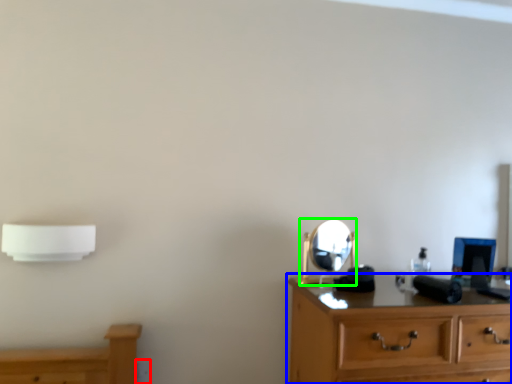
Question: Based on their relative distances, which object is nearer to electric outlet (highlighted by a red box)? Choose from chest of drawers (highlighted by a blue box) and mirror (highlighted by a green box).

Choices:
 (A) chest of drawers
 (B) mirror

Answer: (B)